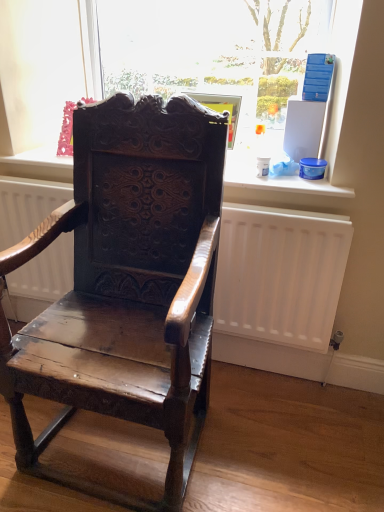
Question: Is white matte radiator at center to the right of shiny dark wood chair at center from the viewer's perspective?

Choices:
 (A) no
 (B) yes

Answer: (B)

Question: Considering the relative sizes of white matte radiator at center and shiny dark wood chair at center in the image provided, is white matte radiator at center taller than shiny dark wood chair at center?

Choices:
 (A) no
 (B) yes

Answer: (A)

Question: Considering the relative sizes of white matte radiator at center and shiny dark wood chair at center in the image provided, is white matte radiator at center shorter than shiny dark wood chair at center?

Choices:
 (A) yes
 (B) no

Answer: (A)

Question: Is white matte radiator at center to the left of shiny dark wood chair at center from the viewer's perspective?

Choices:
 (A) no
 (B) yes

Answer: (A)

Question: From the image's perspective, does white matte radiator at center appear lower than shiny dark wood chair at center?

Choices:
 (A) yes
 (B) no

Answer: (B)

Question: From the image's perspective, is white matte radiator at center on top of shiny dark wood chair at center?

Choices:
 (A) yes
 (B) no

Answer: (A)

Question: Is transparent glass at upper center a part of shiny dark wood chair at center?

Choices:
 (A) no
 (B) yes

Answer: (A)

Question: Is shiny dark wood chair at center thinner than transparent glass at upper center?

Choices:
 (A) no
 (B) yes

Answer: (A)

Question: Is shiny dark wood chair at center located outside transparent glass at upper center?

Choices:
 (A) no
 (B) yes

Answer: (B)

Question: Is transparent glass at upper center at the back of shiny dark wood chair at center?

Choices:
 (A) yes
 (B) no

Answer: (A)

Question: Considering the relative positions of shiny dark wood chair at center and transparent glass at upper center in the image provided, is shiny dark wood chair at center to the right of transparent glass at upper center from the viewer's perspective?

Choices:
 (A) no
 (B) yes

Answer: (A)

Question: Is shiny dark wood chair at center far from transparent glass at upper center?

Choices:
 (A) yes
 (B) no

Answer: (B)

Question: Considering the relative sizes of transparent glass at upper center and white matte radiator at center in the image provided, is transparent glass at upper center thinner than white matte radiator at center?

Choices:
 (A) yes
 (B) no

Answer: (A)